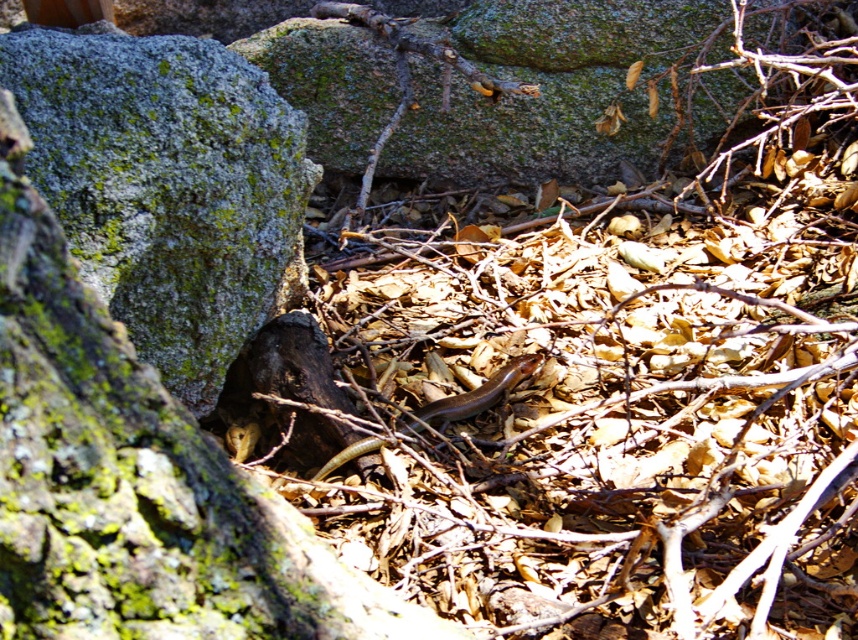
You are standing in a forest and want to take a photo of the point at coordinates (201, 384). If your camera can focus on objects within 5 feet, will it be able to capture the point clearly?

The distance of point (201, 384) from camera is 5.09 feet, so the camera cannot focus on it since it is slightly beyond the 5 feet range.